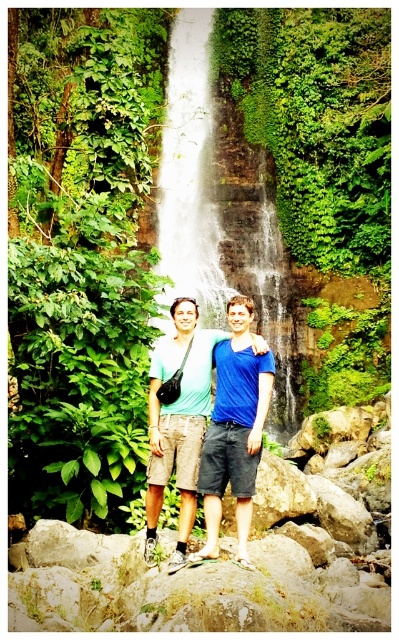
You are planning to take a photo of the white textured waterfall at center and the blue matte shirt at center. Which object should you focus on first if you want to capture both in one shot without moving the camera?

The white textured waterfall at center is bigger than the blue matte shirt at center, so you should focus on the white textured waterfall at center first to ensure it fills the frame appropriately before adjusting for the smaller blue matte shirt at center.

You are a photographer trying to capture a clear photo of the blue matte shirt at center without the white textured waterfall at center blocking it. What should you do?

The blue matte shirt at center is behind the white textured waterfall at center, so you should move the blue matte shirt at center forward or move the white textured waterfall at center backward to ensure it is not blocked.